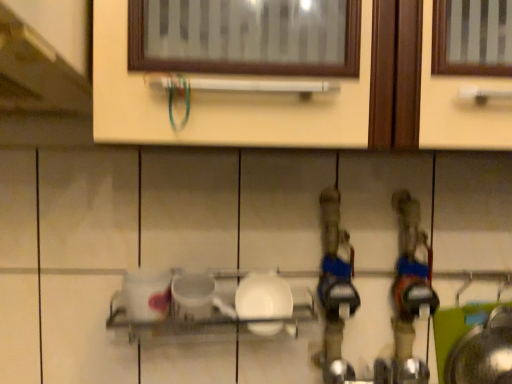
What do you see at coordinates (263, 297) in the screenshot?
I see `white glossy plate at center` at bounding box center [263, 297].

You are a GUI agent. You are given a task and a screenshot of the screen. Output one action in this format:
    pyautogui.click(x=<x>, y=<y>)
    Task: Click on the white glossy plate at center
    The width and height of the screenshot is (512, 384).
    Given the screenshot: What is the action you would take?
    pyautogui.click(x=263, y=297)

What do you see at coordinates (198, 312) in the screenshot?
I see `white glossy plate at center` at bounding box center [198, 312].

Find the location of `white glossy plate at center`. white glossy plate at center is located at coordinates (198, 312).

This screenshot has width=512, height=384. Find the location of `white glossy plate at center`. white glossy plate at center is located at coordinates (263, 297).

Is white glossy plate at center to the left or to the right of white glossy plate at center in the image?

In the image, white glossy plate at center appears on the right side of white glossy plate at center.

Is white glossy plate at center in front of white glossy plate at center?

That is False.

Is point (285, 295) closer or farther from the camera than point (157, 287)?

Point (285, 295) is farther from the camera than point (157, 287).

From the image's perspective, is white glossy plate at center located above or below white glossy plate at center?

Based on their image positions, white glossy plate at center is located above white glossy plate at center.

From a real-world perspective, between white glossy plate at center and white glossy plate at center, who is vertically lower?

white glossy plate at center is physically lower.

Does white glossy plate at center have a lesser width compared to white glossy plate at center?

Indeed, white glossy plate at center has a lesser width compared to white glossy plate at center.

In terms of height, does white glossy plate at center look taller or shorter compared to white glossy plate at center?

white glossy plate at center is taller than white glossy plate at center.

Who is bigger, white glossy plate at center or white glossy plate at center?

white glossy plate at center.

Do you think white glossy plate at center is within white glossy plate at center, or outside of it?

white glossy plate at center is enclosed within white glossy plate at center.

Would you consider white glossy plate at center to be distant from white glossy plate at center?

white glossy plate at center is actually quite close to white glossy plate at center.

Could you tell me if white glossy plate at center is facing white glossy plate at center?

Yes, white glossy plate at center is oriented towards white glossy plate at center.

What's the angular difference between white glossy plate at center and white glossy plate at center's facing directions?

There is a 2.28-degree angle between the facing directions of white glossy plate at center and white glossy plate at center.

The image size is (512, 384). Find the location of `tableware located on the right of white glossy plate at center`. tableware located on the right of white glossy plate at center is located at coordinates (263, 297).

In the scene shown: Based on their positions, is white glossy plate at center located to the left or right of white glossy plate at center?

In the image, white glossy plate at center appears on the left side of white glossy plate at center.

Considering the positions of objects white glossy plate at center and white glossy plate at center in the image provided, who is in front, white glossy plate at center or white glossy plate at center?

Positioned in front is white glossy plate at center.

Considering the points (228, 309) and (259, 275), which point is in front, point (228, 309) or point (259, 275)?

Positioned in front is point (228, 309).

From the image's perspective, is white glossy plate at center on top of white glossy plate at center?

Incorrect, from the image's perspective, white glossy plate at center is lower than white glossy plate at center.

From a real-world perspective, relative to white glossy plate at center, is white glossy plate at center vertically above or below?

From a real-world perspective, white glossy plate at center is physically below white glossy plate at center.

Does white glossy plate at center have a lesser width compared to white glossy plate at center?

Incorrect, the width of white glossy plate at center is not less than that of white glossy plate at center.

Is white glossy plate at center taller or shorter than white glossy plate at center?

In the image, white glossy plate at center appears to be shorter than white glossy plate at center.

Is white glossy plate at center smaller than white glossy plate at center?

No.

Is white glossy plate at center a part of white glossy plate at center?

Yes, white glossy plate at center can be found within white glossy plate at center.

Are white glossy plate at center and white glossy plate at center making contact?

Yes, white glossy plate at center is in contact with white glossy plate at center.

Is white glossy plate at center aimed at white glossy plate at center?

Yes, white glossy plate at center faces towards white glossy plate at center.

Locate an element on the screen. This screenshot has height=384, width=512. shelf in front of the white glossy plate at center is located at coordinates (198, 312).

The height and width of the screenshot is (384, 512). In order to click on shelf below the white glossy plate at center (from the image's perspective) in this screenshot , I will do `click(198, 312)`.

The width and height of the screenshot is (512, 384). What are the coordinates of `tableware lying behind the white glossy plate at center` in the screenshot? It's located at (263, 297).